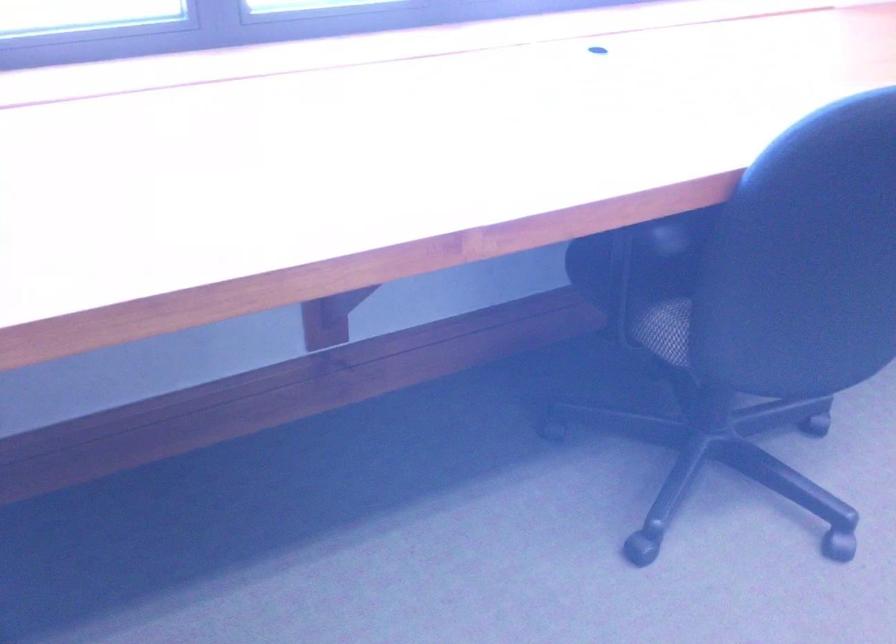
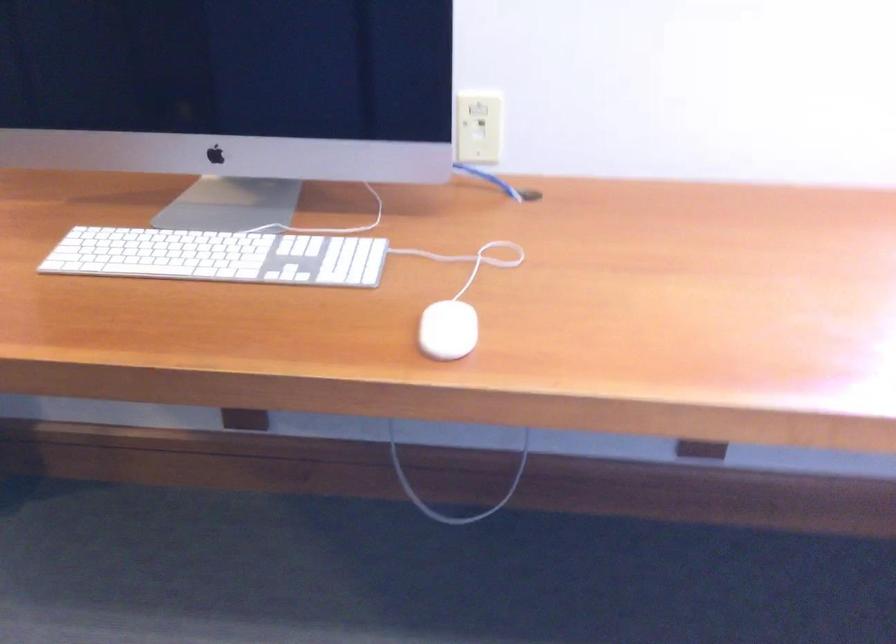
Question: The camera is either moving clockwise (left) or counter-clockwise (right) around the object. The first image is from the beginning of the video and the second image is from the end. Is the camera moving left or right when shooting the video?

Choices:
 (A) Left
 (B) Right

Answer: (B)